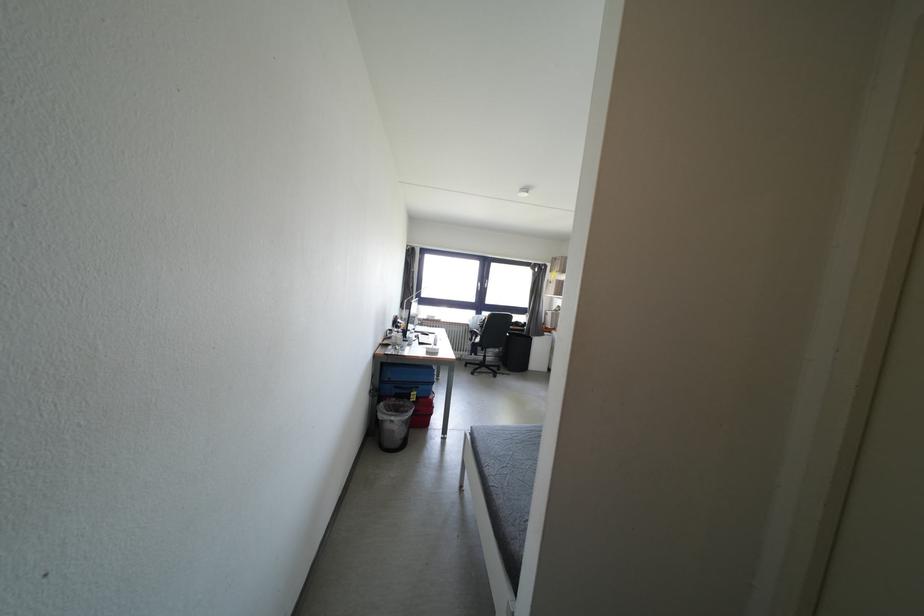
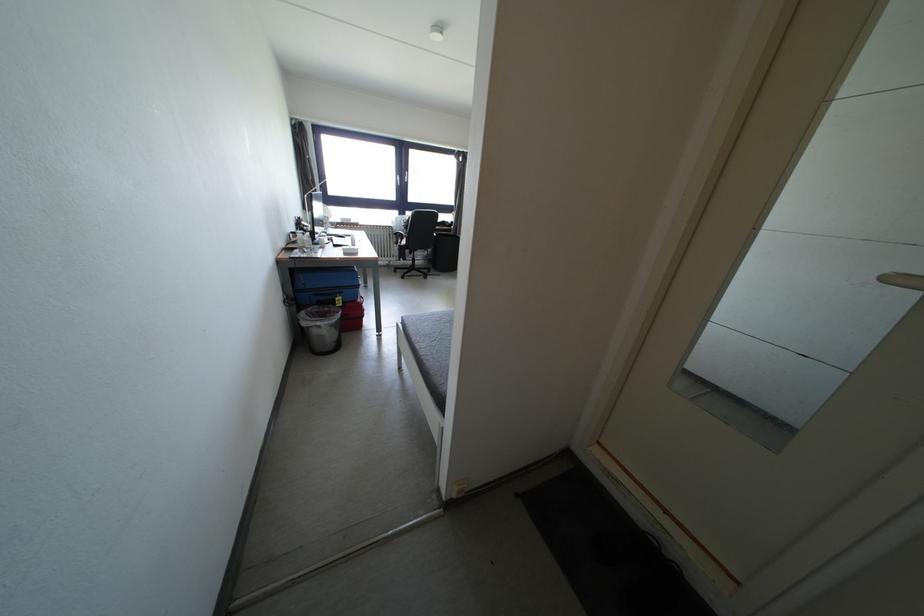
Question: I am providing you with two images of the same scene from different viewpoints. Which of the following objects are not visible in image2?

Choices:
 (A) black cylindrical bin
 (B) white door handle
 (C) chair sitting surface
 (D) none of these

Answer: (D)